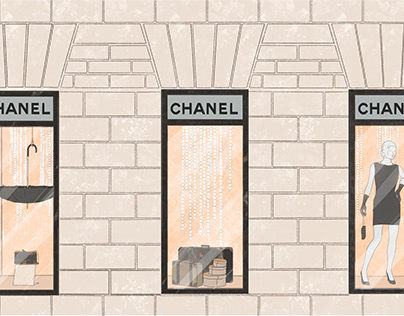
This screenshot has width=404, height=316. In order to click on the right of window in this screenshot , I will do `click(265, 186)`.